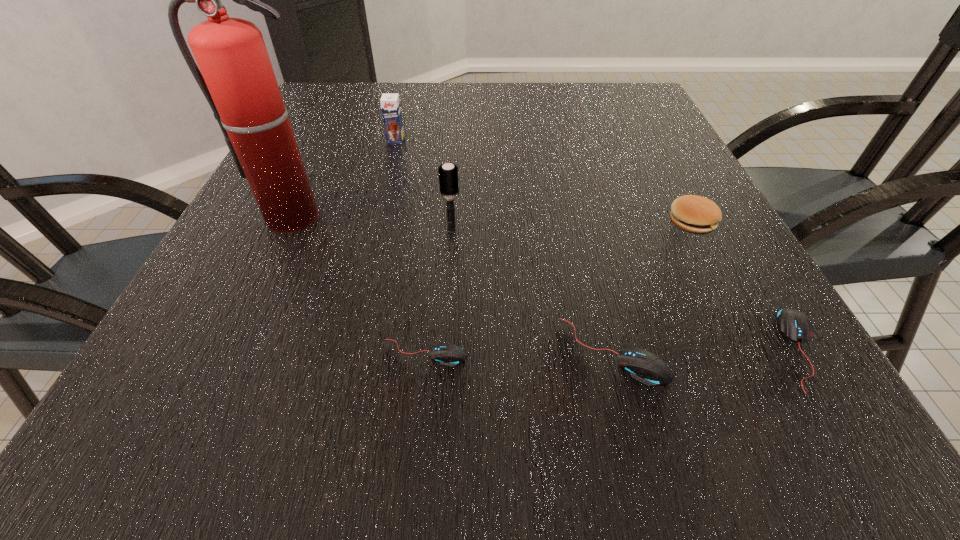
The mouses are evenly distributed in the image. To maintain this, where would you place another mouse on the left? Please point to a free space. Please provide its 2D coordinates. Your answer should be formatted as a tuple, i.e. [(x, y)], where the tuple contains the x and y coordinates of a point satisfying the conditions above.

[(235, 355)]